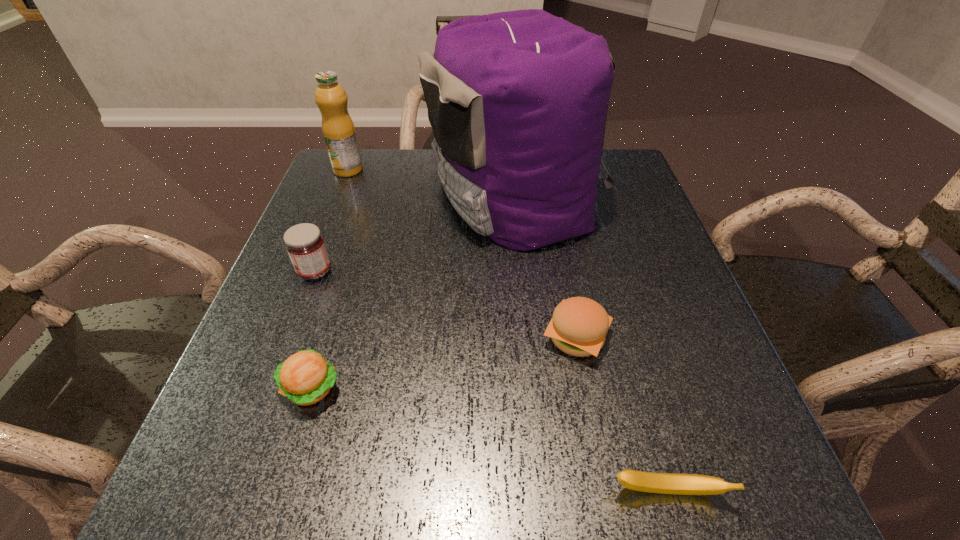
You are a GUI agent. You are given a task and a screenshot of the screen. Output one action in this format:
    pyautogui.click(x=<x>, y=<y>)
    Task: Click on the free location that satisfies the following two spatial constraints: 1. on the back side of the right hamburger; 2. on the front pocket of the backpack
    
    Given the screenshot: What is the action you would take?
    pyautogui.click(x=549, y=197)

Image resolution: width=960 pixels, height=540 pixels. In order to click on vacant space that satisfies the following two spatial constraints: 1. on the front pocket of the right hamburger; 2. on the right side of the tallest object in this screenshot , I will do [x=529, y=338].

Where is `vacant space that satisfies the following two spatial constraints: 1. on the front label of the fruit juice; 2. on the left side of the right hamburger`? Image resolution: width=960 pixels, height=540 pixels. vacant space that satisfies the following two spatial constraints: 1. on the front label of the fruit juice; 2. on the left side of the right hamburger is located at coordinates (281, 338).